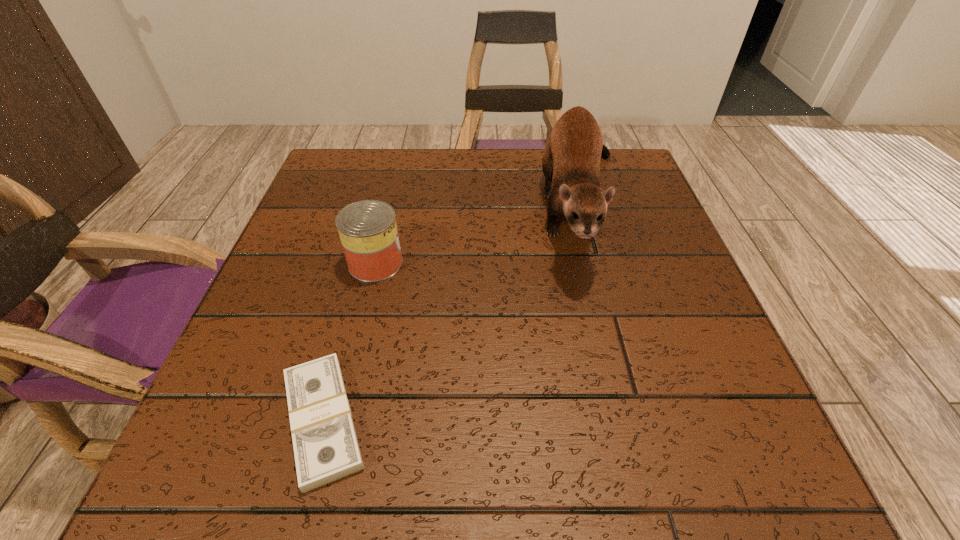
Where is `free area in between the tallest object and the shortest object`? free area in between the tallest object and the shortest object is located at coordinates (453, 314).

The image size is (960, 540). In order to click on unoccupied position between the shortest object and the can in this screenshot , I will do `click(349, 342)`.

Point out which object is positioned as the nearest to the nearest object. Please provide its 2D coordinates. Your answer should be formatted as a tuple, i.e. [(x, y)], where the tuple contains the x and y coordinates of a point satisfying the conditions above.

[(367, 229)]

The height and width of the screenshot is (540, 960). Find the location of `the second closest object relative to the ferret`. the second closest object relative to the ferret is located at coordinates coord(326,449).